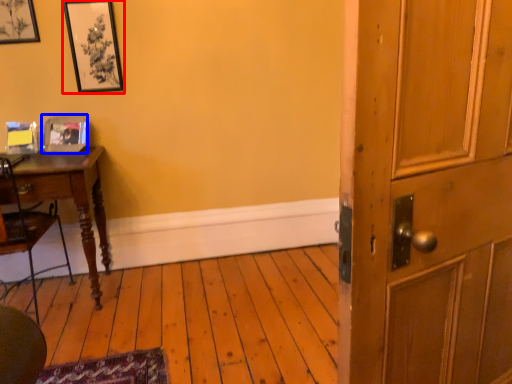
Question: Which of the following is the farthest to the observer, picture frame (highlighted by a red box) or picture frame (highlighted by a blue box)?

Choices:
 (A) picture frame
 (B) picture frame

Answer: (B)